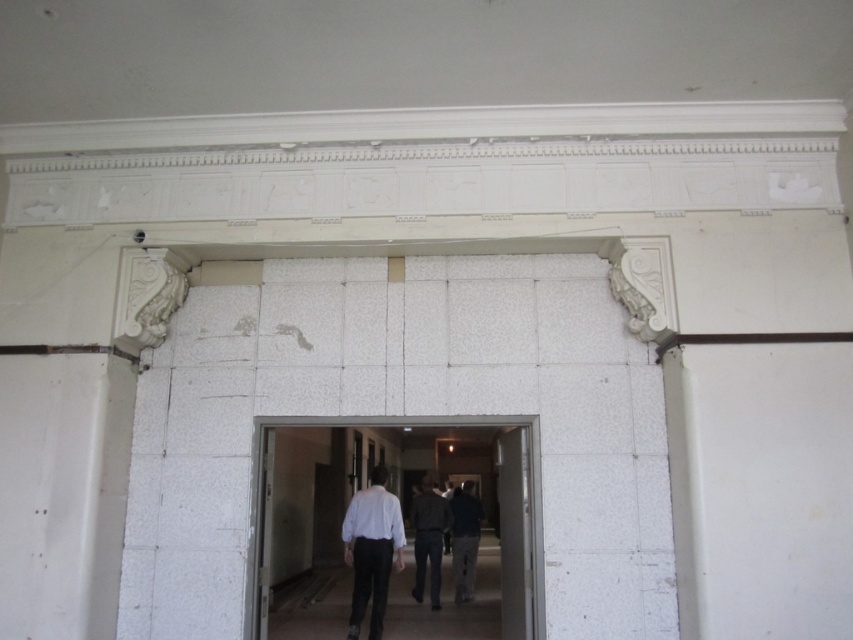
The image size is (853, 640). What do you see at coordinates (393, 426) in the screenshot? I see `white textured door at center` at bounding box center [393, 426].

Does point (538, 584) come farther from viewer compared to point (352, 532)?

No, (538, 584) is in front of (352, 532).

In order to click on white textured door at center in this screenshot , I will do `click(393, 426)`.

Which is behind, point (416, 534) or point (453, 522)?

The point (453, 522) is behind.

In order to click on dark gray fabric jacket at center in this screenshot , I will do `click(428, 538)`.

Which is more to the left, white matte shirt at center or dark gray fabric jacket at center?

Positioned to the left is white matte shirt at center.

Is white matte shirt at center to the right of dark gray fabric jacket at center from the viewer's perspective?

No, white matte shirt at center is not to the right of dark gray fabric jacket at center.

Is point (363, 611) positioned after point (433, 582)?

No, it is not.

Locate an element on the screen. This screenshot has height=640, width=853. white matte shirt at center is located at coordinates (370, 548).